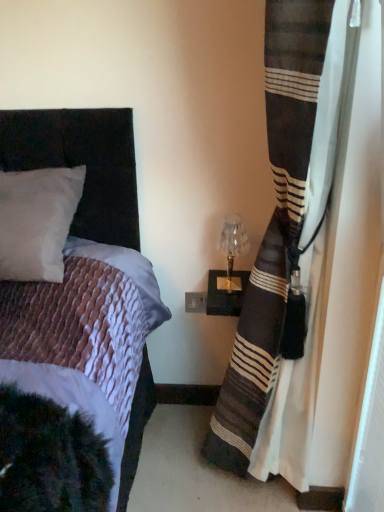
In order to click on striped fabric curtain at right in this screenshot , I will do `click(284, 237)`.

Image resolution: width=384 pixels, height=512 pixels. What do you see at coordinates (284, 237) in the screenshot? I see `striped fabric curtain at right` at bounding box center [284, 237].

Measure the distance between point (222, 282) and camera.

The distance of point (222, 282) from camera is 4.86 feet.

This screenshot has width=384, height=512. In order to click on translucent glass table lamp at upper right in this screenshot , I will do pos(232,250).

The image size is (384, 512). What do you see at coordinates (232, 250) in the screenshot? I see `translucent glass table lamp at upper right` at bounding box center [232, 250].

This screenshot has height=512, width=384. What are the coordinates of `striped fabric curtain at right` in the screenshot? It's located at (284, 237).

Which is more to the left, translucent glass table lamp at upper right or striped fabric curtain at right?

From the viewer's perspective, translucent glass table lamp at upper right appears more on the left side.

Is translucent glass table lamp at upper right further to camera compared to striped fabric curtain at right?

Yes, translucent glass table lamp at upper right is behind striped fabric curtain at right.

Which is more distant, [230,289] or [299,149]?

The point [230,289] is farther from the camera.

Looking at this image, from the image's perspective, is translucent glass table lamp at upper right above striped fabric curtain at right?

Yes, from the image's perspective, translucent glass table lamp at upper right is over striped fabric curtain at right.

From a real-world perspective, who is located higher, translucent glass table lamp at upper right or striped fabric curtain at right?

striped fabric curtain at right, from a real-world perspective.

Which of these two, translucent glass table lamp at upper right or striped fabric curtain at right, is wider?

With larger width is striped fabric curtain at right.

Who is taller, translucent glass table lamp at upper right or striped fabric curtain at right?

Standing taller between the two is striped fabric curtain at right.

Who is smaller, translucent glass table lamp at upper right or striped fabric curtain at right?

translucent glass table lamp at upper right is smaller.

Is striped fabric curtain at right a part of translucent glass table lamp at upper right?

That's incorrect, striped fabric curtain at right is not inside translucent glass table lamp at upper right.

Is translucent glass table lamp at upper right not close to striped fabric curtain at right?

No, there isn't a large distance between translucent glass table lamp at upper right and striped fabric curtain at right.

Is translucent glass table lamp at upper right facing away from striped fabric curtain at right?

No, translucent glass table lamp at upper right's orientation is not away from striped fabric curtain at right.

What's the angular difference between translucent glass table lamp at upper right and striped fabric curtain at right's facing directions?

There is a 84.8-degree angle between the facing directions of translucent glass table lamp at upper right and striped fabric curtain at right.

What are the coordinates of `table lamp located behind the striped fabric curtain at right` in the screenshot? It's located at (232, 250).

Is striped fabric curtain at right at the left side of translucent glass table lamp at upper right?

No.

Considering the positions of objects striped fabric curtain at right and translucent glass table lamp at upper right in the image provided, who is in front, striped fabric curtain at right or translucent glass table lamp at upper right?

striped fabric curtain at right.

Is point (264, 301) farther from camera compared to point (222, 232)?

No, it is not.

From the image's perspective, which object appears higher, striped fabric curtain at right or translucent glass table lamp at upper right?

From the image's view, translucent glass table lamp at upper right is above.

From a real-world perspective, does striped fabric curtain at right sit lower than translucent glass table lamp at upper right?

No, from a real-world perspective, striped fabric curtain at right is not beneath translucent glass table lamp at upper right.

Does striped fabric curtain at right have a lesser width compared to translucent glass table lamp at upper right?

Incorrect, the width of striped fabric curtain at right is not less than that of translucent glass table lamp at upper right.

Who is taller, striped fabric curtain at right or translucent glass table lamp at upper right?

striped fabric curtain at right is taller.

Considering the sizes of objects striped fabric curtain at right and translucent glass table lamp at upper right in the image provided, who is bigger, striped fabric curtain at right or translucent glass table lamp at upper right?

striped fabric curtain at right is bigger.

Is translucent glass table lamp at upper right inside striped fabric curtain at right?

No, translucent glass table lamp at upper right is not surrounded by striped fabric curtain at right.

Is striped fabric curtain at right not near translucent glass table lamp at upper right?

Actually, striped fabric curtain at right and translucent glass table lamp at upper right are a little close together.

Is striped fabric curtain at right oriented towards translucent glass table lamp at upper right?

No, striped fabric curtain at right is not turned towards translucent glass table lamp at upper right.

Can you tell me how much striped fabric curtain at right and translucent glass table lamp at upper right differ in facing direction?

84.8 degrees separate the facing orientations of striped fabric curtain at right and translucent glass table lamp at upper right.

At what (x,y) coordinates should I click in order to perform the action: click on curtain on the right of translucent glass table lamp at upper right. Please return your answer as a coordinate pair (x, y). The image size is (384, 512). Looking at the image, I should click on (284, 237).

The height and width of the screenshot is (512, 384). What are the coordinates of `curtain below the translucent glass table lamp at upper right (from the image's perspective)` in the screenshot? It's located at (284, 237).

The image size is (384, 512). Identify the location of table lamp above the striped fabric curtain at right (from the image's perspective). (232, 250).